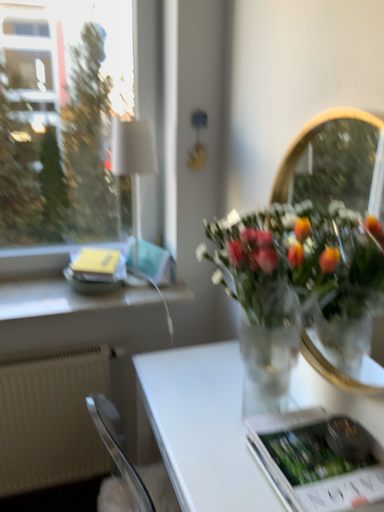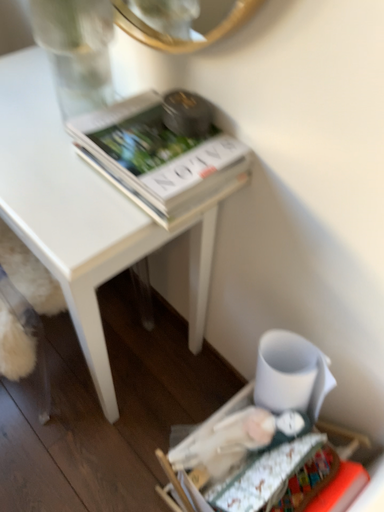
Question: Which way did the camera rotate in the video?

Choices:
 (A) rotated left
 (B) rotated right

Answer: (B)